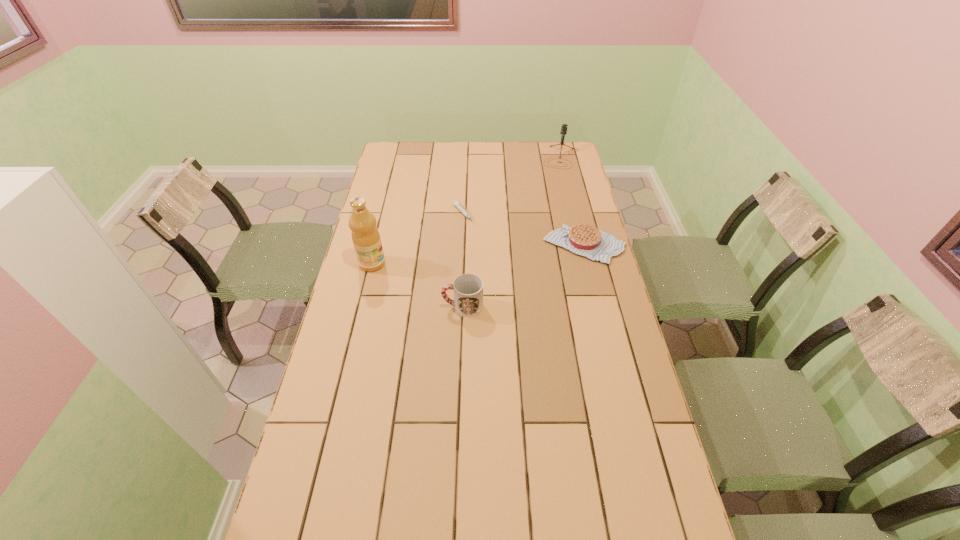
Where is `vacant point located 0.110m on the label of the leftmost object`? This screenshot has height=540, width=960. vacant point located 0.110m on the label of the leftmost object is located at coordinates (415, 266).

Identify the location of vacant space located 0.300m on the label of the leftmost object. This screenshot has width=960, height=540. (468, 269).

Where is `vacant space located on the label of the leftmost object`? vacant space located on the label of the leftmost object is located at coordinates (453, 268).

What are the coordinates of `vacant space located on the stand of the microphone` in the screenshot? It's located at (553, 202).

Locate an element on the screen. Image resolution: width=960 pixels, height=540 pixels. free space located 0.080m on the stand of the microphone is located at coordinates (557, 179).

Locate an element on the screen. blank area located 0.390m on the stand of the microphone is located at coordinates (549, 221).

Locate an element on the screen. free location located at the needle end of the syringe is located at coordinates (484, 238).

This screenshot has width=960, height=540. Identify the location of vacant area located at the needle end of the syringe. (506, 261).

Locate an element on the screen. vacant area situated at the needle end of the syringe is located at coordinates (512, 268).

This screenshot has width=960, height=540. I want to click on object that is positioned at the far edge, so click(x=564, y=126).